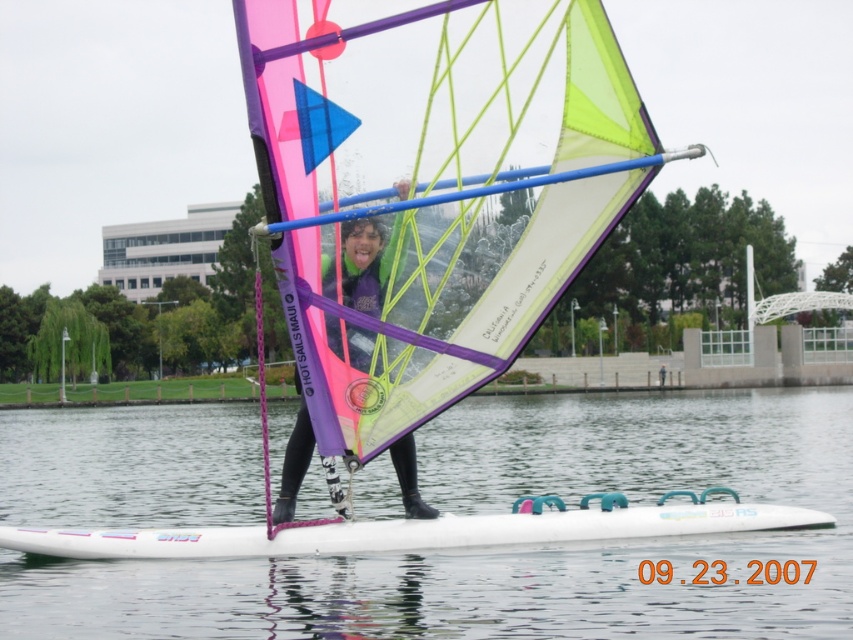
Between white matte surfboard at center and pink matte windsurf sail at center, which one appears on the left side from the viewer's perspective?

From the viewer's perspective, white matte surfboard at center appears more on the left side.

Is point (252, 536) more distant than point (374, 241)?

Yes.

Who is more forward, (x=84, y=538) or (x=381, y=288)?

A: Point (x=381, y=288)

Identify the location of white matte surfboard at center. The image size is (853, 640). (419, 531).

Between white foam board at center and pink matte windsurf sail at center, which one appears on the right side from the viewer's perspective?

Positioned to the right is white foam board at center.

Is white foam board at center shorter than pink matte windsurf sail at center?

Indeed, white foam board at center has a lesser height compared to pink matte windsurf sail at center.

Which is in front, point (90, 564) or point (286, 449)?

Positioned in front is point (90, 564).

Identify the location of white foam board at center. (520, 547).

Which is below, white foam board at center or neon pink/transparent sail at center?

white foam board at center is lower down.

Does white foam board at center have a greater width compared to neon pink/transparent sail at center?

Yes, white foam board at center is wider than neon pink/transparent sail at center.

What do you see at coordinates (520, 547) in the screenshot? This screenshot has height=640, width=853. I see `white foam board at center` at bounding box center [520, 547].

This screenshot has height=640, width=853. Find the location of `white foam board at center`. white foam board at center is located at coordinates (520, 547).